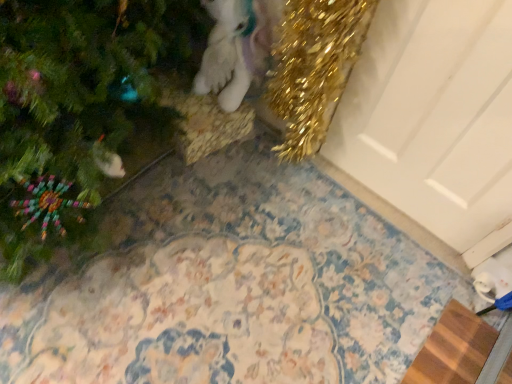
Question: From a real-world perspective, is white plush unicorn at upper center on white matte door at upper right?

Choices:
 (A) yes
 (B) no

Answer: (B)

Question: Is the position of white plush unicorn at upper center less distant than that of white matte door at upper right?

Choices:
 (A) yes
 (B) no

Answer: (B)

Question: Would you say white plush unicorn at upper center is a long distance from white matte door at upper right?

Choices:
 (A) yes
 (B) no

Answer: (B)

Question: From the image's perspective, is white plush unicorn at upper center located beneath white matte door at upper right?

Choices:
 (A) yes
 (B) no

Answer: (B)

Question: Does white plush unicorn at upper center have a greater height compared to white matte door at upper right?

Choices:
 (A) yes
 (B) no

Answer: (B)

Question: Considering their positions, is white plush unicorn at upper center located in front of or behind brown woven mat at lower right?

Choices:
 (A) behind
 (B) front

Answer: (B)

Question: From a real-world perspective, relative to brown woven mat at lower right, is white plush unicorn at upper center vertically above or below?

Choices:
 (A) above
 (B) below

Answer: (A)

Question: Is point (197, 77) closer or farther from the camera than point (456, 342)?

Choices:
 (A) closer
 (B) farther

Answer: (B)

Question: From the image's perspective, is white plush unicorn at upper center above or below brown woven mat at lower right?

Choices:
 (A) above
 (B) below

Answer: (A)

Question: From a real-world perspective, is green matte christmas tree at upper left above or below white plush unicorn at upper center?

Choices:
 (A) above
 (B) below

Answer: (A)

Question: Choose the correct answer: Is green matte christmas tree at upper left inside white plush unicorn at upper center or outside it?

Choices:
 (A) inside
 (B) outside

Answer: (B)

Question: Does point (111, 142) appear closer or farther from the camera than point (267, 28)?

Choices:
 (A) closer
 (B) farther

Answer: (A)

Question: Is green matte christmas tree at upper left in front of or behind white plush unicorn at upper center in the image?

Choices:
 (A) front
 (B) behind

Answer: (A)

Question: From the image's perspective, is brown woven mat at lower right located above or below white matte door at upper right?

Choices:
 (A) above
 (B) below

Answer: (B)

Question: Is brown woven mat at lower right bigger or smaller than white matte door at upper right?

Choices:
 (A) big
 (B) small

Answer: (B)